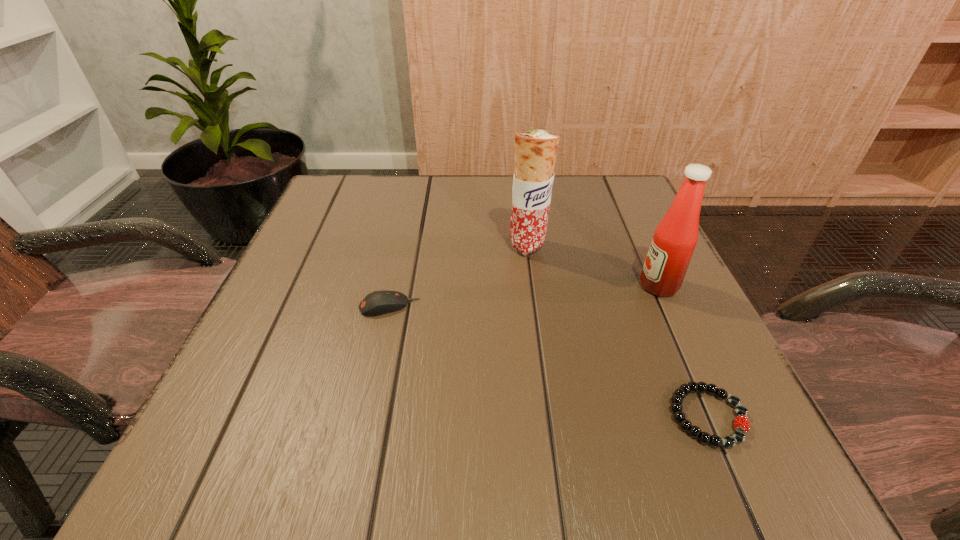
In order to click on free point between the burrito and the nearest object in this screenshot , I will do `click(618, 331)`.

This screenshot has height=540, width=960. What are the coordinates of `unoccupied area between the condiment and the second object from left to right` in the screenshot? It's located at (593, 266).

The width and height of the screenshot is (960, 540). I want to click on the third closest object to the condiment, so click(x=376, y=303).

Locate which object ranks third in proximity to the condiment. Please provide its 2D coordinates. Your answer should be formatted as a tuple, i.e. [(x, y)], where the tuple contains the x and y coordinates of a point satisfying the conditions above.

[(376, 303)]

At what (x,y) coordinates should I click in order to perform the action: click on vacant region that satisfies the following two spatial constraints: 1. on the back side of the third object from right to left; 2. on the left side of the computer mouse. Please return your answer as a coordinate pair (x, y). The width and height of the screenshot is (960, 540). Looking at the image, I should click on (402, 246).

This screenshot has height=540, width=960. In order to click on vacant space that satisfies the following two spatial constraints: 1. on the front side of the farthest object; 2. on the right side of the shortest object in this screenshot , I will do `click(550, 416)`.